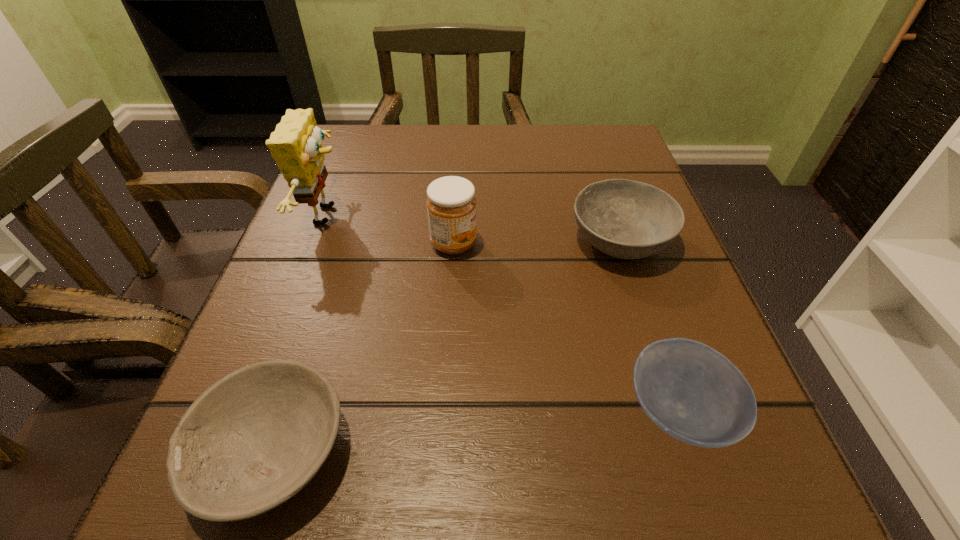
You are a GUI agent. You are given a task and a screenshot of the screen. Output one action in this format:
    pyautogui.click(x=<x>, y=<y>)
    Task: Click on the free space at the near right corner of the desktop
    
    Given the screenshot: What is the action you would take?
    pyautogui.click(x=787, y=525)

You are a GUI agent. You are given a task and a screenshot of the screen. Output one action in this format:
    pyautogui.click(x=<x>, y=<y>)
    Task: Click on the empty space between the third object from right to left and the farthest bowl
    
    Given the screenshot: What is the action you would take?
    [537, 242]

Identify the location of free space between the leftmost bowl and the tallest object. The width and height of the screenshot is (960, 540). (300, 333).

Locate an element on the screen. This screenshot has height=540, width=960. vacant area that lies between the leftmost bowl and the tallest object is located at coordinates (x=300, y=333).

This screenshot has width=960, height=540. I want to click on empty space that is in between the third object from right to left and the tallest object, so click(391, 230).

Where is `vacant area between the farthest bowl and the leftmost bowl`? This screenshot has width=960, height=540. vacant area between the farthest bowl and the leftmost bowl is located at coordinates (445, 346).

Identify the location of unoccupied position between the leftmost bowl and the jam. The image size is (960, 540). (363, 347).

Find the location of `object that is the closest to the farthest bowl`. object that is the closest to the farthest bowl is located at coordinates (451, 203).

Identify the location of the second closest object to the third object from right to left. The width and height of the screenshot is (960, 540). (626, 219).

Locate an element on the screen. Image resolution: width=960 pixels, height=540 pixels. bowl that is the closest to the sponge is located at coordinates (251, 441).